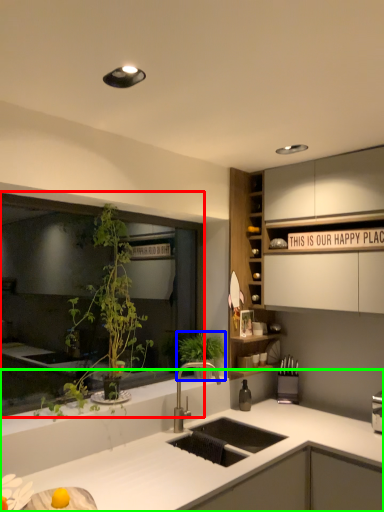
Question: Which object is positioned closest to window (highlighted by a red box)? Select from vegetation (highlighted by a blue box) and countertop (highlighted by a green box).

Choices:
 (A) vegetation
 (B) countertop

Answer: (A)